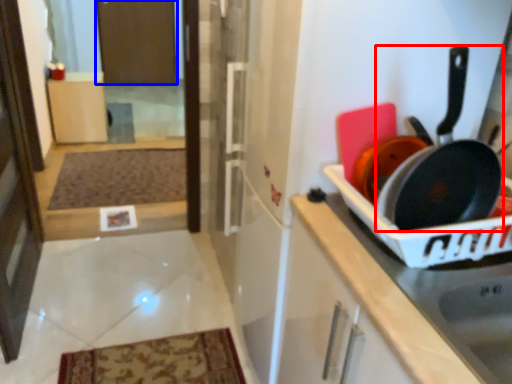
Question: Which object appears farthest to the camera in this image, frying pan (highlighted by a red box) or screen door (highlighted by a blue box)?

Choices:
 (A) frying pan
 (B) screen door

Answer: (B)